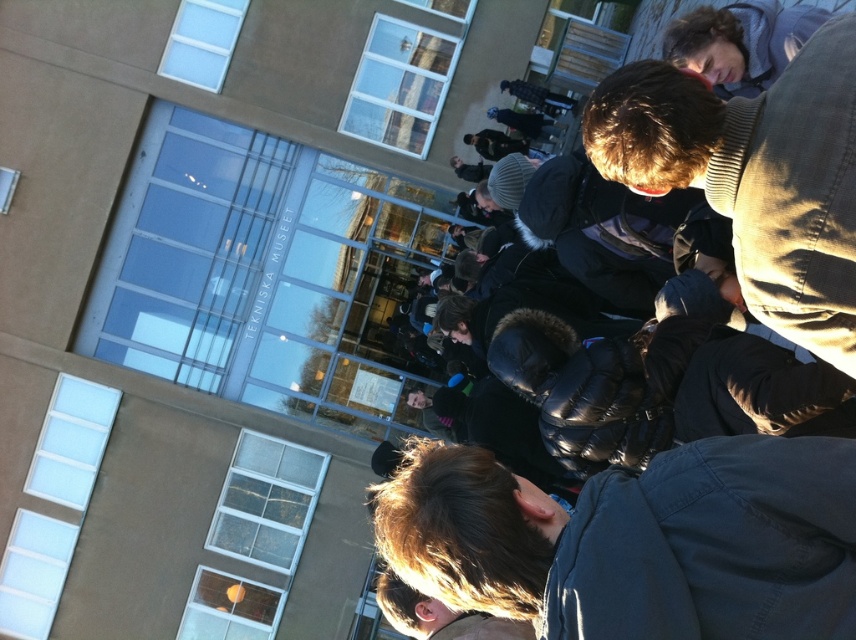
Who is shorter, dark brown sweater at center or matte black backpack at upper center?

matte black backpack at upper center

Find the location of a particular element. The height and width of the screenshot is (640, 856). dark brown sweater at center is located at coordinates (755, 176).

Between point (753, 292) and point (544, 100), which one is positioned behind?

The point (544, 100) is behind.

Is dark blue jacket at center taller than matte black backpack at upper center?

Yes.

This screenshot has width=856, height=640. I want to click on dark blue jacket at center, so click(x=637, y=541).

Looking at this image, is dark brown hair at upper right bigger than blonde hair at lower center?

Actually, dark brown hair at upper right might be smaller than blonde hair at lower center.

Does dark brown hair at upper right appear over blonde hair at lower center?

Correct, dark brown hair at upper right is located above blonde hair at lower center.

Where is `dark brown hair at upper right`? This screenshot has height=640, width=856. dark brown hair at upper right is located at coordinates (740, 42).

This screenshot has width=856, height=640. What are the coordinates of `dark brown hair at upper right` in the screenshot? It's located at (740, 42).